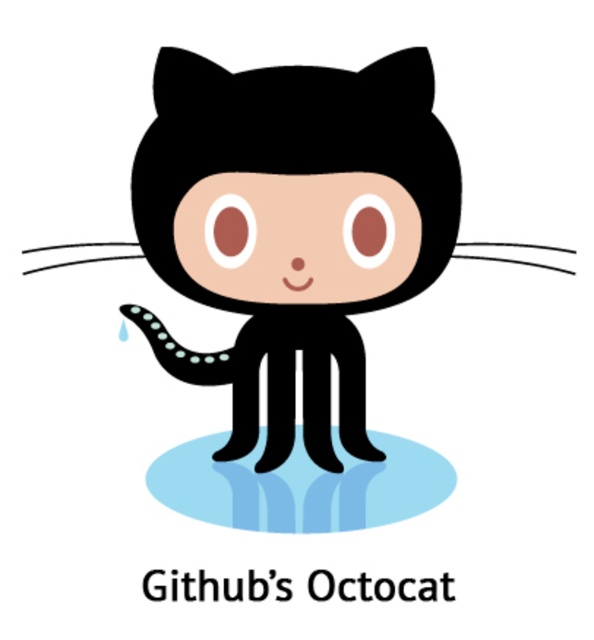
Between black matte octopus at center and blue glossy puddle at center, which one appears on the left side from the viewer's perspective?

blue glossy puddle at center is more to the left.

Is black matte octopus at center to the left of blue glossy puddle at center from the viewer's perspective?

Incorrect, black matte octopus at center is not on the left side of blue glossy puddle at center.

Between point (352, 296) and point (299, 525), which one is positioned behind?

Positioned behind is point (352, 296).

Image resolution: width=594 pixels, height=640 pixels. I want to click on black matte octopus at center, so click(292, 228).